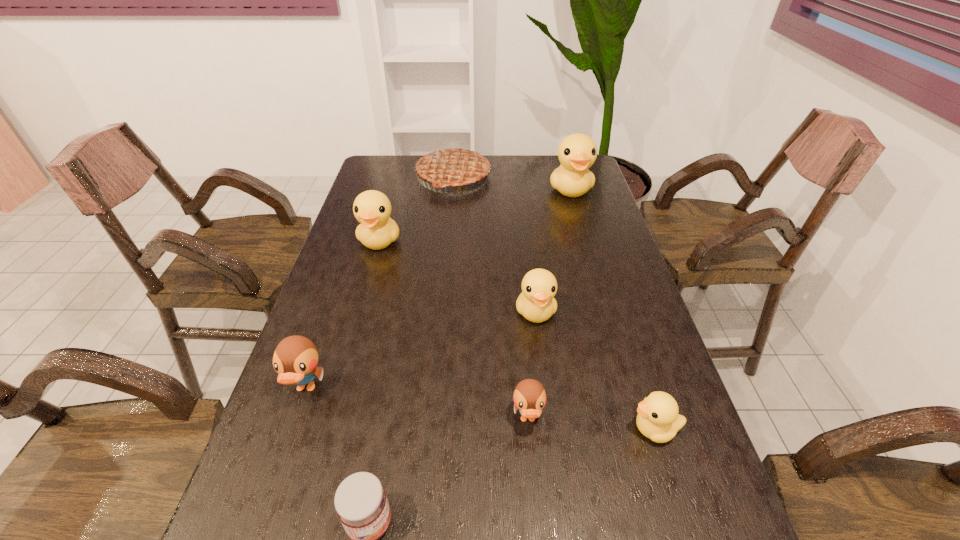
Where is `pie`? The height and width of the screenshot is (540, 960). pie is located at coordinates (455, 165).

Where is `the farthest duck`? Image resolution: width=960 pixels, height=540 pixels. the farthest duck is located at coordinates (577, 152).

The height and width of the screenshot is (540, 960). What are the coordinates of `the tallest duck` in the screenshot? It's located at (577, 152).

Where is `the sixth shortest object`? This screenshot has height=540, width=960. the sixth shortest object is located at coordinates (372, 208).

Where is `the second biggest yellow duck`? This screenshot has width=960, height=540. the second biggest yellow duck is located at coordinates (372, 208).

You are a GUI agent. You are given a task and a screenshot of the screen. Output one action in this format:
    pyautogui.click(x=<x>, y=<y>)
    Task: Click on the third yellow duck from right to left
    
    Given the screenshot: What is the action you would take?
    pyautogui.click(x=536, y=303)

Identify the location of the fourth nearest duck. (536, 303).

You are a GUI agent. You are given a task and a screenshot of the screen. Output one action in this format:
    pyautogui.click(x=<x>, y=<y>)
    Task: Click on the bigger blue duck
    The image size is (960, 540).
    Given the screenshot: What is the action you would take?
    pyautogui.click(x=295, y=359)

Image resolution: width=960 pixels, height=540 pixels. Find the location of `the right blue duck`. the right blue duck is located at coordinates coord(529,397).

Identify the location of the nearest yellow duck. (658, 419).